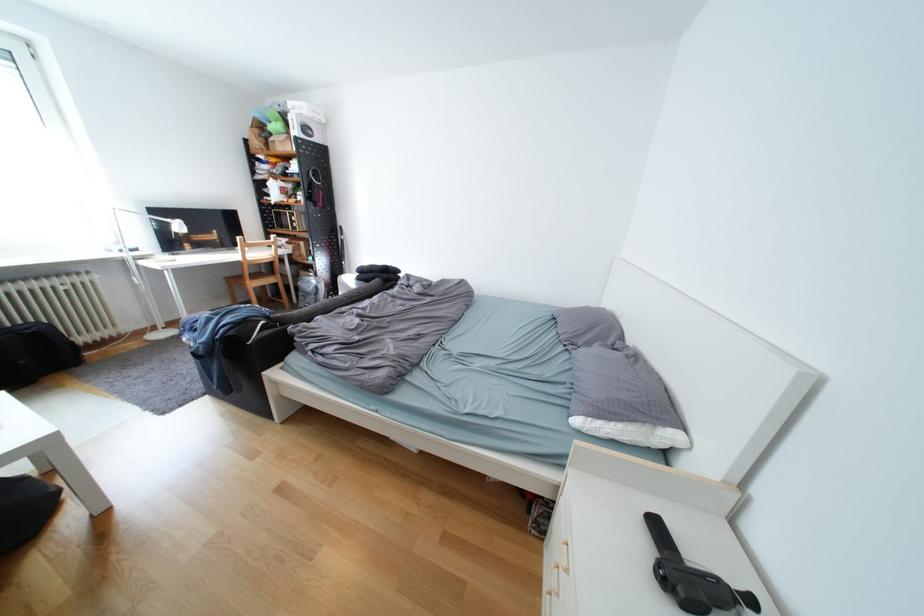
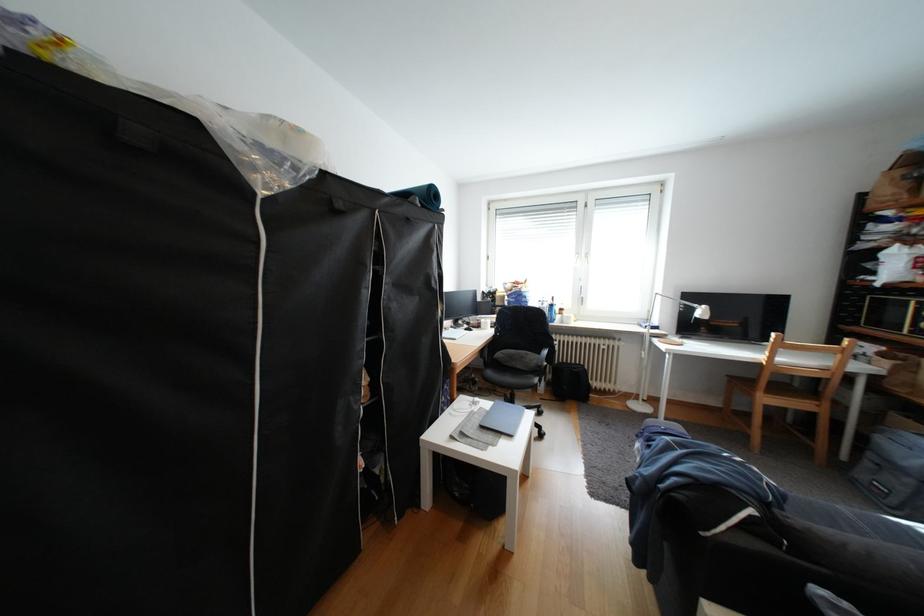
Locate, in the second image, the point that corresponds to point 265,285 in the first image.

(779, 400)